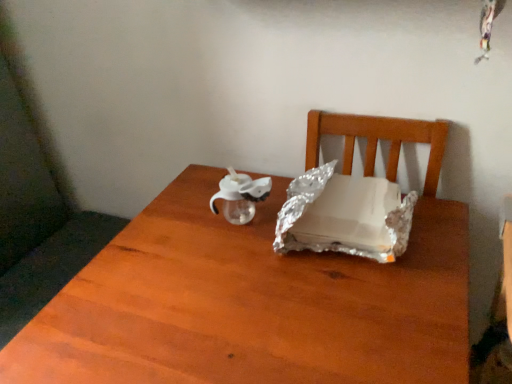
Describe the element at coordinates (251, 304) in the screenshot. I see `wooden table at center` at that location.

Identify the location of wooden table at center. (251, 304).

The width and height of the screenshot is (512, 384). What are the coordinates of `wooden table at center` in the screenshot? It's located at (251, 304).